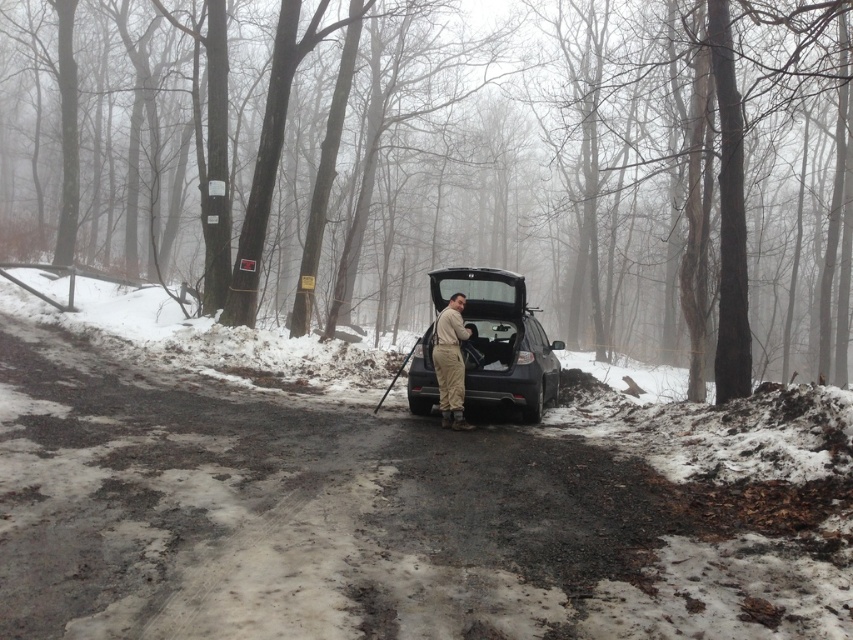
Question: Observing the image, what is the correct spatial positioning of satin black suv at center in reference to tan fabric jumpsuit at center?

Choices:
 (A) left
 (B) right

Answer: (B)

Question: Which of the following is the closest to the observer?

Choices:
 (A) (511, 380)
 (B) (447, 419)

Answer: (B)

Question: Is satin black suv at center further to camera compared to tan fabric jumpsuit at center?

Choices:
 (A) yes
 (B) no

Answer: (A)

Question: Is satin black suv at center further to camera compared to tan fabric jumpsuit at center?

Choices:
 (A) yes
 (B) no

Answer: (A)

Question: Among these points, which one is nearest to the camera?

Choices:
 (A) (450, 365)
 (B) (537, 378)

Answer: (A)